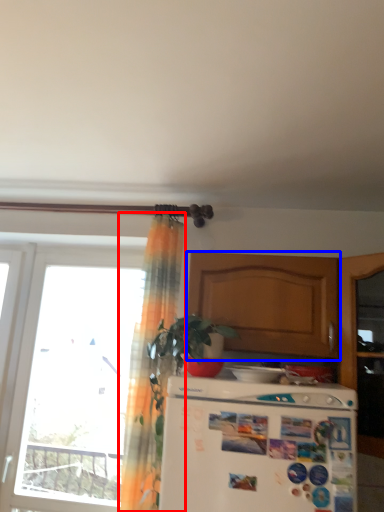
Question: Which of the following is the farthest to the observer, curtain (highlighted by a red box) or cabinetry (highlighted by a blue box)?

Choices:
 (A) curtain
 (B) cabinetry

Answer: (B)